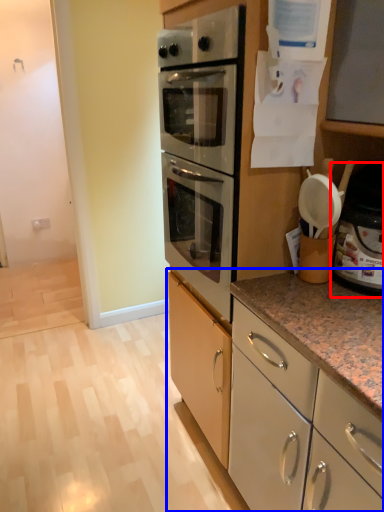
Question: Which object is further to the camera taking this photo, appliance (highlighted by a red box) or cabinetry (highlighted by a blue box)?

Choices:
 (A) appliance
 (B) cabinetry

Answer: (B)